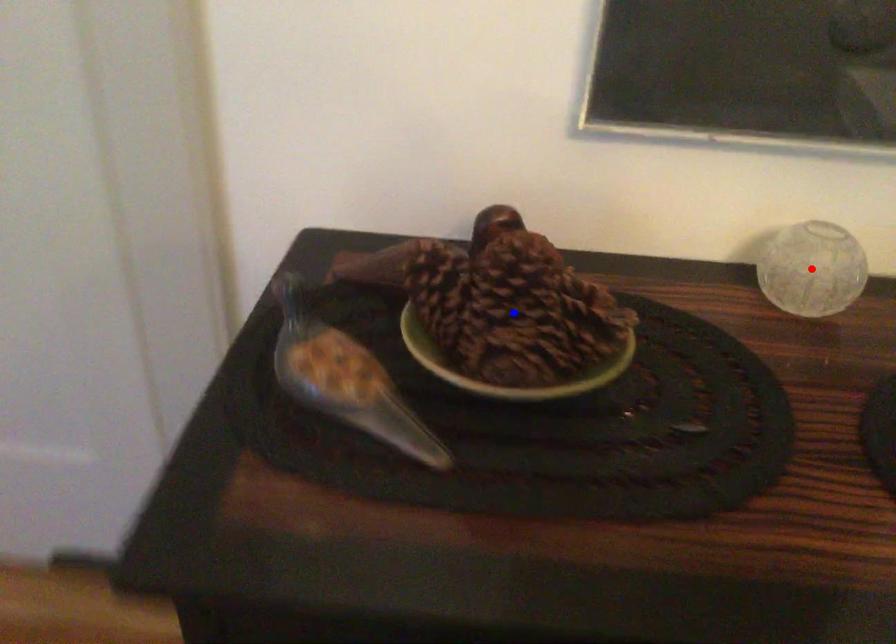
Question: Two points are marked on the image. Which point is closer to the camera?

Choices:
 (A) Blue point is closer.
 (B) Red point is closer.

Answer: (A)